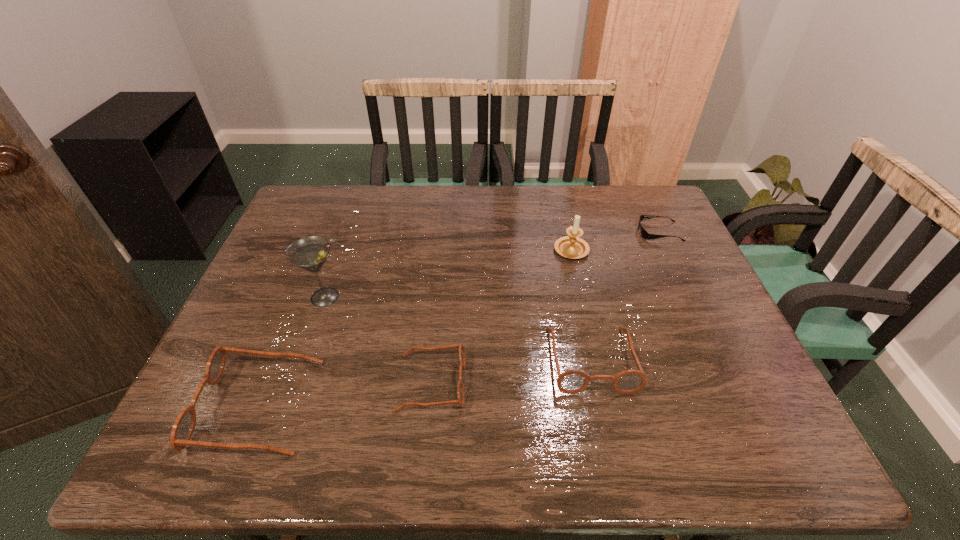
Locate an element on the screen. This screenshot has width=960, height=540. spectacles at the left edge is located at coordinates (183, 428).

Locate an element on the screen. martini that is at the left edge is located at coordinates (310, 253).

Locate an element on the screen. This screenshot has width=960, height=540. object that is at the right edge is located at coordinates (644, 233).

This screenshot has height=540, width=960. In order to click on object present at the near left corner in this screenshot , I will do `click(183, 428)`.

Where is `object that is at the far right corner`? The width and height of the screenshot is (960, 540). object that is at the far right corner is located at coordinates (644, 233).

The image size is (960, 540). Identify the location of vacant space at the far edge. (610, 200).

The width and height of the screenshot is (960, 540). I want to click on free point at the left edge, so click(286, 339).

In the image, there is a desktop. At what (x,y) coordinates should I click in order to perform the action: click on blank space at the right edge. Please return your answer as a coordinate pair (x, y). The height and width of the screenshot is (540, 960). Looking at the image, I should click on (703, 329).

You are a GUI agent. You are given a task and a screenshot of the screen. Output one action in this format:
    pyautogui.click(x=<x>, y=<y>)
    Task: Click on the vacant area at the far left corner of the desktop
    
    Given the screenshot: What is the action you would take?
    pyautogui.click(x=320, y=219)

The height and width of the screenshot is (540, 960). I want to click on free space at the near left corner of the desktop, so click(x=239, y=406).